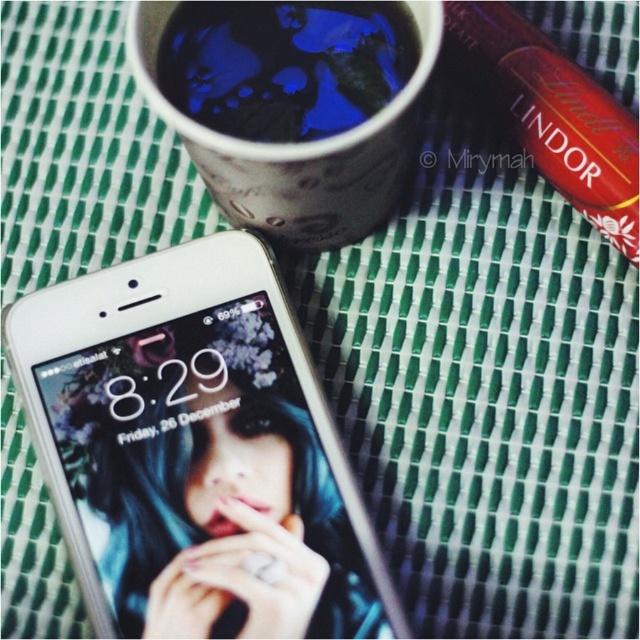
Is point (157, 541) less distant than point (353, 19)?

Yes, point (157, 541) is closer to viewer.

Which of these two, silver metallic smartphone at lower left or blue glossy mug at upper center, stands shorter?

With less height is blue glossy mug at upper center.

The width and height of the screenshot is (640, 640). Find the location of `silver metallic smartphone at lower left`. silver metallic smartphone at lower left is located at coordinates [x=195, y=452].

Can you confirm if blue glossy mug at upper center is positioned below blue matte cup at upper center?

No, blue glossy mug at upper center is not below blue matte cup at upper center.

Is blue glossy mug at upper center in front of blue matte cup at upper center?

No, it is behind blue matte cup at upper center.

Identify the location of blue glossy mug at upper center. The width and height of the screenshot is (640, 640). (x=284, y=65).

Which of these two, silver metallic smartphone at lower left or blue matte cup at upper center, stands taller?

silver metallic smartphone at lower left

Can you confirm if silver metallic smartphone at lower left is taller than blue matte cup at upper center?

Correct, silver metallic smartphone at lower left is much taller as blue matte cup at upper center.

Between point (182, 556) and point (368, 232), which one is positioned behind?

Point (368, 232)

I want to click on silver metallic smartphone at lower left, so click(x=195, y=452).